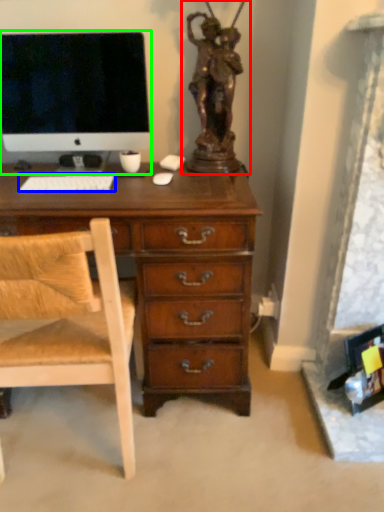
Question: Considering the real-world distances, which object is closest to sculpture (highlighted by a red box)? computer keyboard (highlighted by a blue box) or computer monitor (highlighted by a green box).

Choices:
 (A) computer keyboard
 (B) computer monitor

Answer: (B)